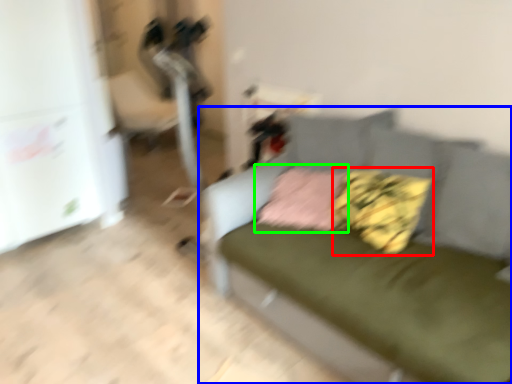
Question: Considering the real-world distances, which object is closest to pillow (highlighted by a red box)? studio couch (highlighted by a blue box) or pillow (highlighted by a green box).

Choices:
 (A) studio couch
 (B) pillow

Answer: (B)